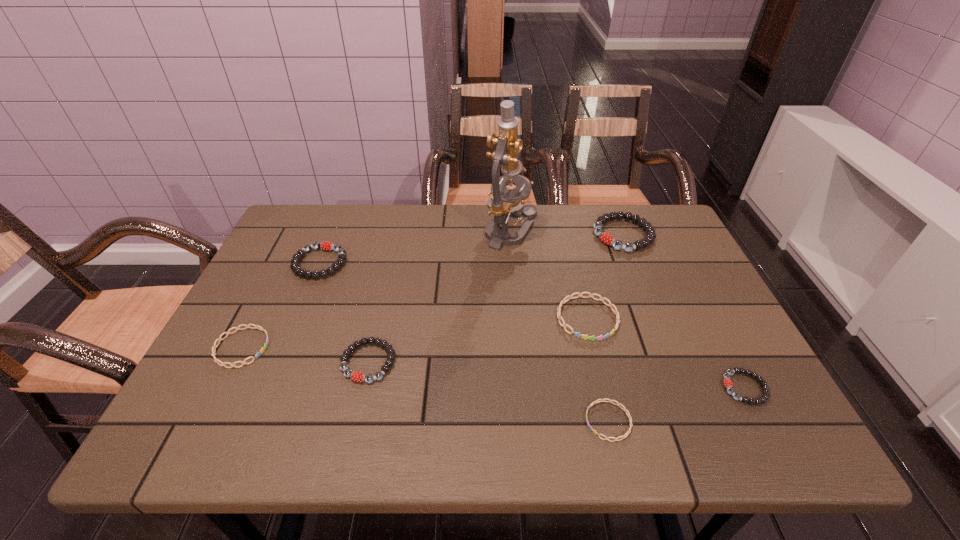
Find the location of a particular element. This screenshot has width=960, height=540. vacant region located on the surface of the smallest blue bracelet showing star-shaped elements is located at coordinates [x=515, y=421].

Find the location of `free space located 0.290m on the surface of the smallest blue bracelet showing star-shaped elements`. free space located 0.290m on the surface of the smallest blue bracelet showing star-shaped elements is located at coordinates (438, 421).

You are a GUI agent. You are given a task and a screenshot of the screen. Output one action in this format:
    pyautogui.click(x=<x>, y=<y>)
    Task: Click on the vacant position located 0.160m on the surface of the smallest blue bracelet showing star-shaped elements
    
    Given the screenshot: What is the action you would take?
    pyautogui.click(x=504, y=421)

Locate an element on the screen. microscope located at the far edge is located at coordinates [x=504, y=203].

Locate an element on the screen. This screenshot has height=540, width=960. object present at the near edge is located at coordinates (601, 400).

Where is `object located at the far left corner`? The image size is (960, 540). object located at the far left corner is located at coordinates (325, 245).

You are a GUI agent. You are given a task and a screenshot of the screen. Output one action in this format:
    pyautogui.click(x=<x>, y=<y>)
    Task: Click on the object positioned at the far right corner
    
    Given the screenshot: What is the action you would take?
    pyautogui.click(x=642, y=222)

Find the location of `free point at the far edge`. free point at the far edge is located at coordinates (583, 210).

Locate an element on the screen. This screenshot has height=540, width=960. vacant space at the near edge is located at coordinates click(x=487, y=410).

This screenshot has height=540, width=960. In the image, there is a desktop. Identify the location of vacant space at the left edge. [x=224, y=390].